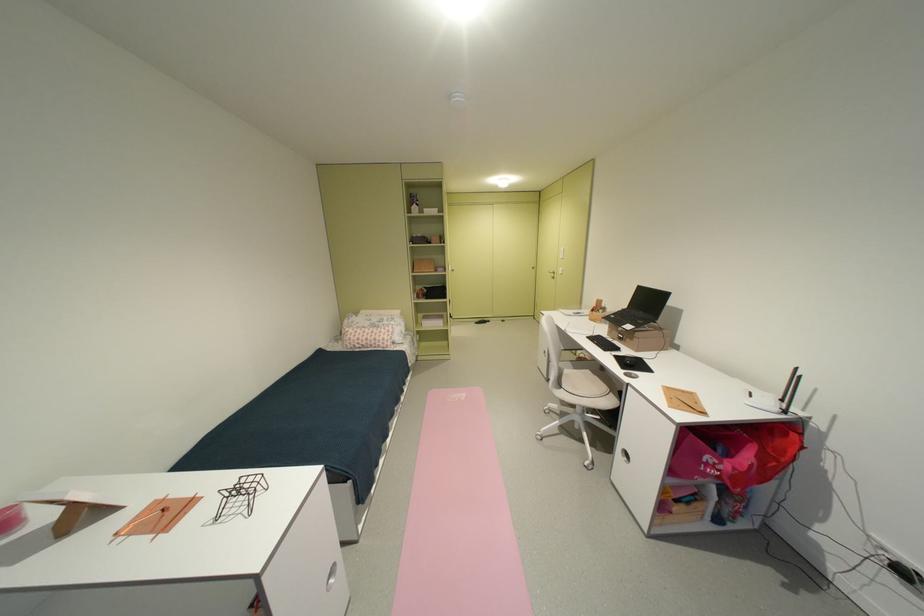
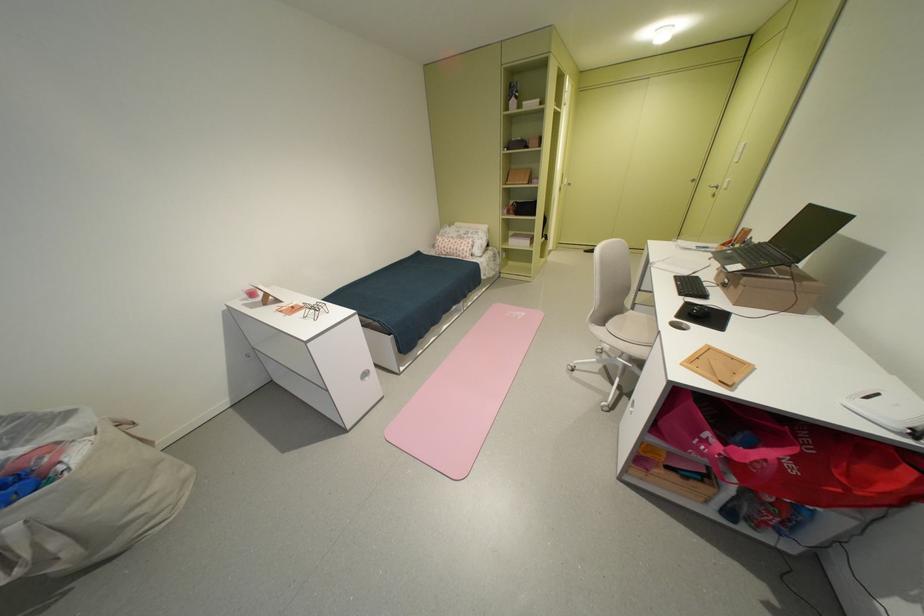
Where in the second image is the point corresponding to point 562,275 from the first image?

(724, 190)